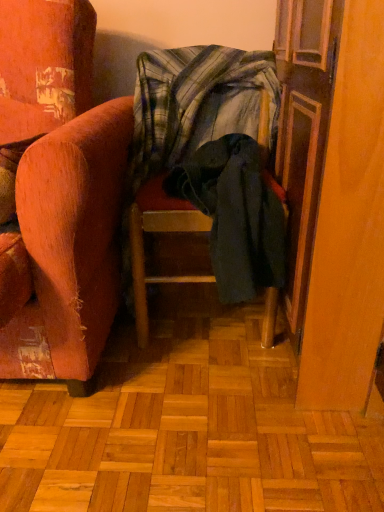
Question: From the image's perspective, is wooden screen door at right above or below dark green fabric chair at center?

Choices:
 (A) below
 (B) above

Answer: (B)

Question: From a real-world perspective, is wooden screen door at right positioned above or below dark green fabric chair at center?

Choices:
 (A) below
 (B) above

Answer: (B)

Question: Estimate the real-world distances between objects in this image. Which object is closer to the dark green fabric chair at center?

Choices:
 (A) wooden screen door at right
 (B) plaid fabric blanket at center

Answer: (B)

Question: Considering the real-world distances, which object is farthest from the dark green fabric chair at center?

Choices:
 (A) wooden screen door at right
 (B) plaid fabric blanket at center

Answer: (A)